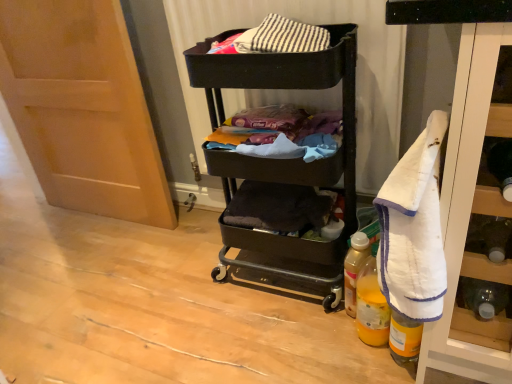
Locate an element on the screen. free spot to the left of black matte cart at center is located at coordinates (186, 298).